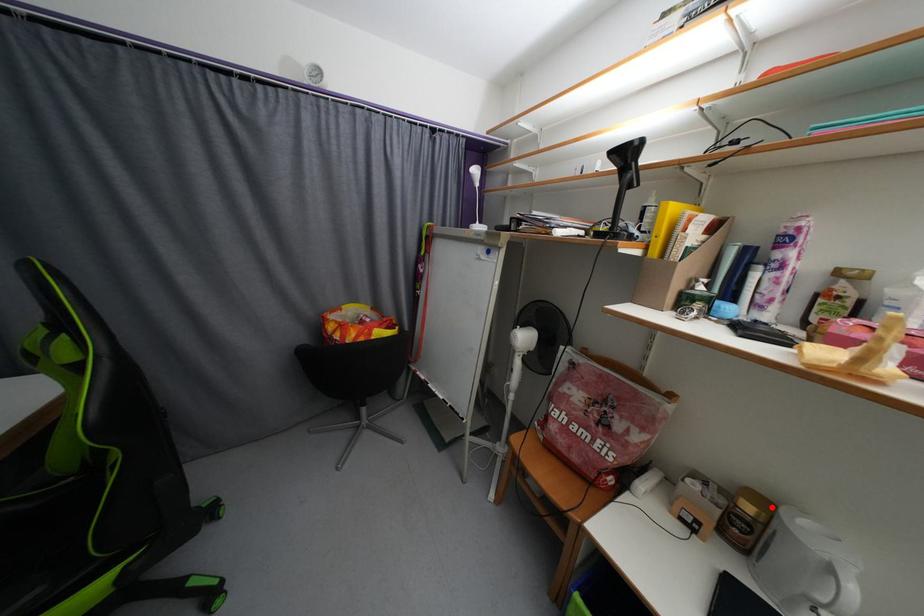
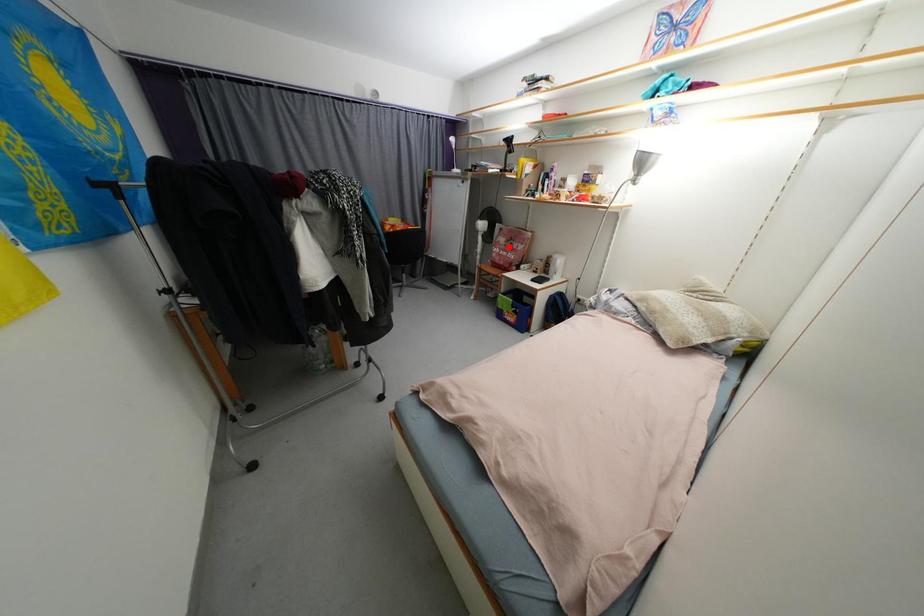
I am providing you with two images of the same scene from different viewpoints. A red point is marked on the first image and another point is marked on the second image. Is the red point in image1 aligned with the point shown in image2?

No